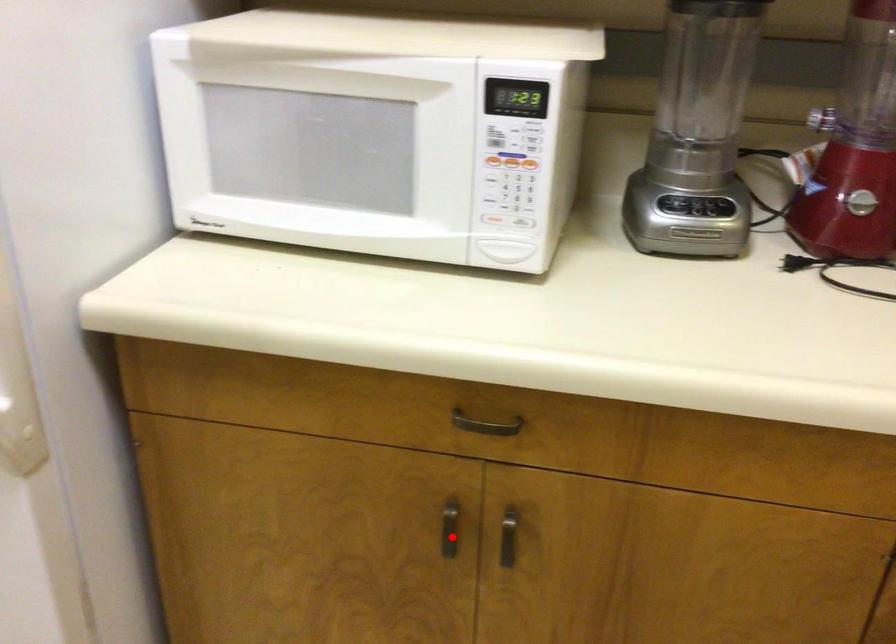
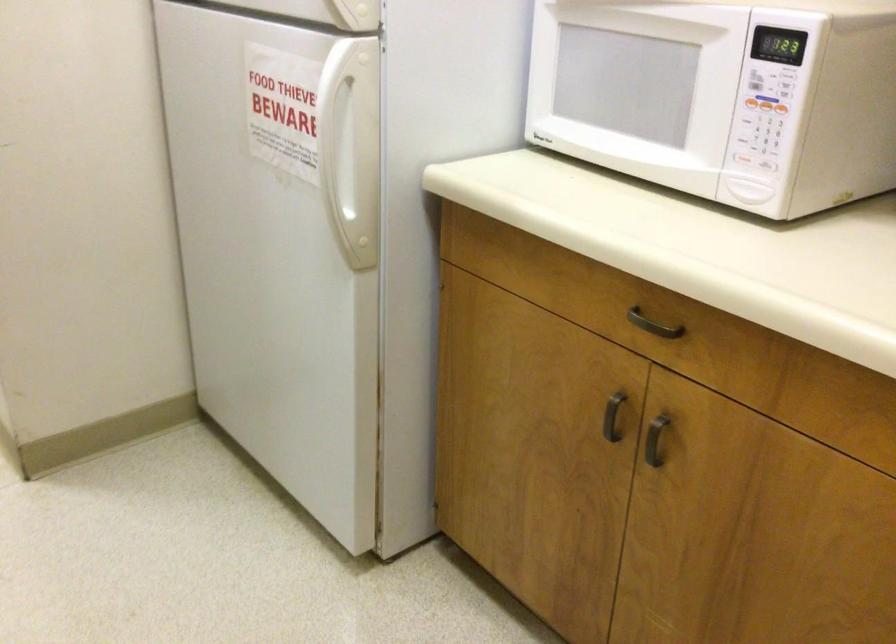
The point at the highlighted location is marked in the first image. Where is the corresponding point in the second image?

(613, 417)